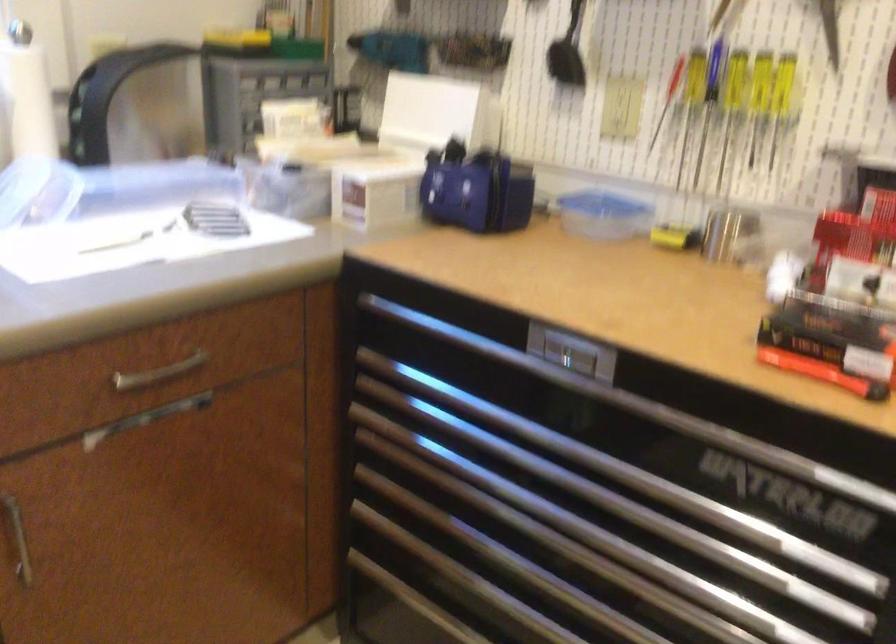
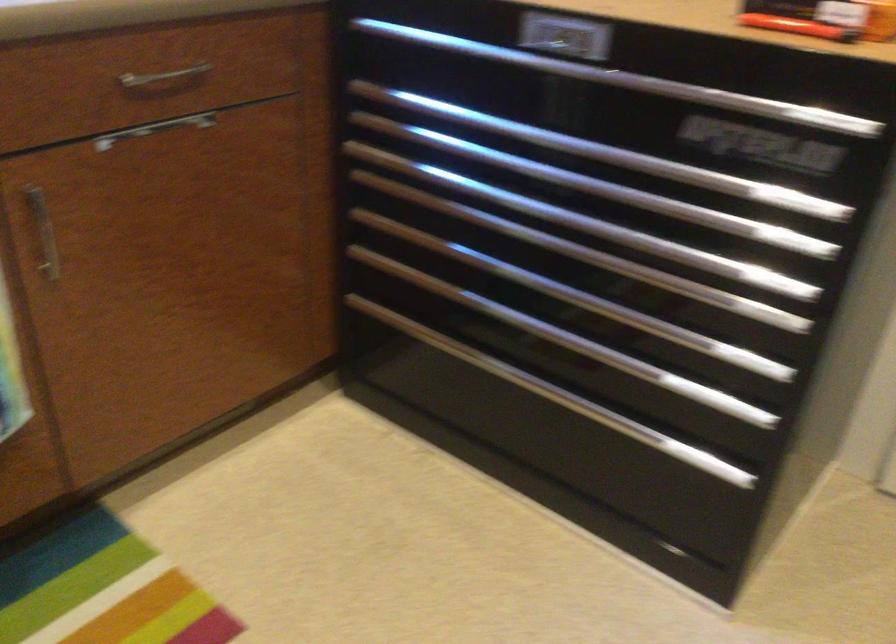
Where in the second image is the point corresponding to (548,514) from the first image?

(538, 209)